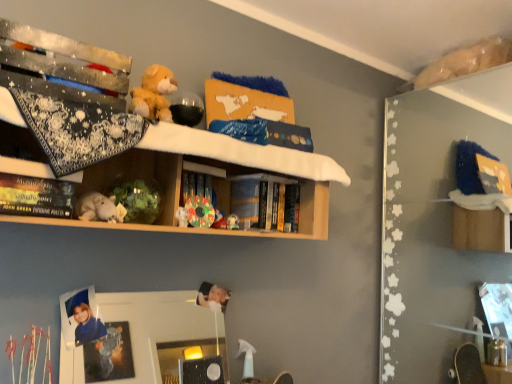
Question: From the image's perspective, would you say clear glass mirror at center is shown under multicolored plastic toy at center, the third toy in the left-to-right sequence?

Choices:
 (A) no
 (B) yes

Answer: (B)

Question: Can you confirm if clear glass mirror at center is thinner than multicolored plastic toy at center, the third toy when ordered from front to back?

Choices:
 (A) yes
 (B) no

Answer: (B)

Question: From a real-world perspective, is clear glass mirror at center on top of multicolored plastic toy at center, the third toy in the left-to-right sequence?

Choices:
 (A) yes
 (B) no

Answer: (B)

Question: From the image's perspective, does clear glass mirror at center appear higher than multicolored plastic toy at center, the first toy positioned from the back?

Choices:
 (A) yes
 (B) no

Answer: (B)

Question: Is clear glass mirror at center taller than multicolored plastic toy at center, the first toy positioned from the back?

Choices:
 (A) no
 (B) yes

Answer: (B)

Question: Considering the relative positions of white plush toy at center, the 1th toy viewed from the left, and clear glass mirror at center in the image provided, is white plush toy at center, the 1th toy viewed from the left, to the left or to the right of clear glass mirror at center?

Choices:
 (A) right
 (B) left

Answer: (B)

Question: From their relative heights in the image, would you say white plush toy at center, the 1th toy viewed from the left, is taller or shorter than clear glass mirror at center?

Choices:
 (A) tall
 (B) short

Answer: (B)

Question: Relative to clear glass mirror at center, is white plush toy at center, the 1th toy viewed from the left, in front or behind?

Choices:
 (A) behind
 (B) front

Answer: (B)

Question: Is white plush toy at center, which is the third toy from back to front, wider or thinner than clear glass mirror at center?

Choices:
 (A) thin
 (B) wide

Answer: (B)

Question: Is multicolored plastic toy at center, the first toy positioned from the back, inside the boundaries of clear glass mirror at center, or outside?

Choices:
 (A) outside
 (B) inside

Answer: (A)

Question: Is multicolored plastic toy at center, the 1th toy when ordered from right to left, wider or thinner than clear glass mirror at center?

Choices:
 (A) thin
 (B) wide

Answer: (A)

Question: Relative to clear glass mirror at center, is multicolored plastic toy at center, the third toy when ordered from front to back, in front or behind?

Choices:
 (A) front
 (B) behind

Answer: (B)

Question: From the image's perspective, relative to clear glass mirror at center, is multicolored plastic toy at center, the first toy positioned from the back, above or below?

Choices:
 (A) below
 (B) above

Answer: (B)

Question: Which is correct: white plush toy at center, which is the third toy from back to front, is inside hardcover book at center, the second book viewed from the left, or outside of it?

Choices:
 (A) outside
 (B) inside

Answer: (A)

Question: Looking at their shapes, would you say white plush toy at center, the first toy from the front, is wider or thinner than hardcover book at center, acting as the 1th book starting from the back?

Choices:
 (A) thin
 (B) wide

Answer: (B)